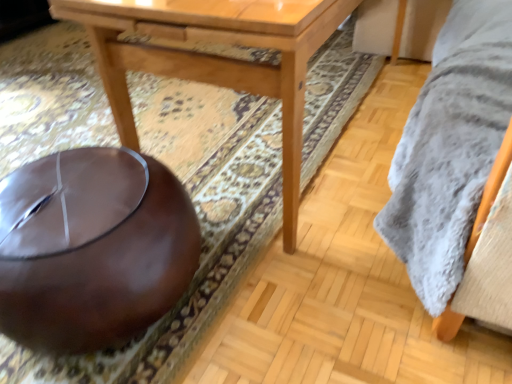
Question: Considering the positions of point (269, 9) and point (41, 192), is point (269, 9) closer or farther from the camera than point (41, 192)?

Choices:
 (A) closer
 (B) farther

Answer: (A)

Question: From a real-world perspective, is light brown wood table at center positioned above or below brown leather bean bag at lower left?

Choices:
 (A) below
 (B) above

Answer: (B)

Question: Is light brown wood table at center to the left or to the right of brown leather bean bag at lower left in the image?

Choices:
 (A) left
 (B) right

Answer: (B)

Question: Would you say brown leather bean bag at lower left is to the left or to the right of light brown wood table at center in the picture?

Choices:
 (A) right
 (B) left

Answer: (B)

Question: From a real-world perspective, is brown leather bean bag at lower left positioned above or below light brown wood table at center?

Choices:
 (A) above
 (B) below

Answer: (B)

Question: In terms of height, does brown leather bean bag at lower left look taller or shorter compared to light brown wood table at center?

Choices:
 (A) tall
 (B) short

Answer: (B)

Question: Considering their positions, is brown leather bean bag at lower left located in front of or behind light brown wood table at center?

Choices:
 (A) front
 (B) behind

Answer: (A)